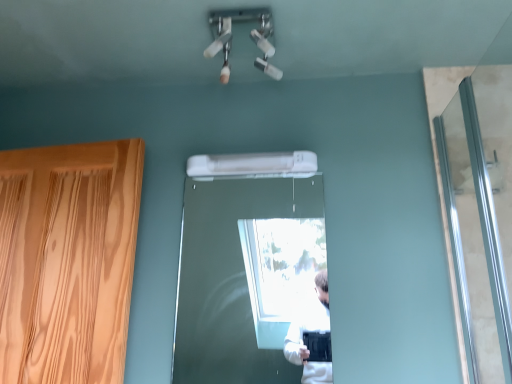
Question: Is white plastic air conditioner at center at the left side of silver metallic screen door at right?

Choices:
 (A) yes
 (B) no

Answer: (A)

Question: Is white plastic air conditioner at center further to camera compared to silver metallic screen door at right?

Choices:
 (A) yes
 (B) no

Answer: (A)

Question: Is white plastic air conditioner at center positioned beyond the bounds of silver metallic screen door at right?

Choices:
 (A) yes
 (B) no

Answer: (A)

Question: Does white plastic air conditioner at center have a greater height compared to silver metallic screen door at right?

Choices:
 (A) yes
 (B) no

Answer: (B)

Question: Does white plastic air conditioner at center turn towards silver metallic screen door at right?

Choices:
 (A) yes
 (B) no

Answer: (B)

Question: Considering the positions of white plastic air conditioner at center and silver metallic screen door at right in the image, is white plastic air conditioner at center bigger or smaller than silver metallic screen door at right?

Choices:
 (A) big
 (B) small

Answer: (B)

Question: Is white plastic air conditioner at center wider or thinner than silver metallic screen door at right?

Choices:
 (A) wide
 (B) thin

Answer: (A)

Question: Considering the positions of white plastic air conditioner at center and silver metallic screen door at right in the image, is white plastic air conditioner at center taller or shorter than silver metallic screen door at right?

Choices:
 (A) short
 (B) tall

Answer: (A)

Question: Choose the correct answer: Is white plastic air conditioner at center inside silver metallic screen door at right or outside it?

Choices:
 (A) outside
 (B) inside

Answer: (A)

Question: Is silver metallic screen door at right in front of or behind white plastic air conditioner at center in the image?

Choices:
 (A) behind
 (B) front

Answer: (B)

Question: Do you think silver metallic screen door at right is within white plastic air conditioner at center, or outside of it?

Choices:
 (A) outside
 (B) inside

Answer: (A)

Question: Is point (489, 155) closer or farther from the camera than point (204, 178)?

Choices:
 (A) farther
 (B) closer

Answer: (B)

Question: In the image, is silver metallic screen door at right on the left side or the right side of white plastic air conditioner at center?

Choices:
 (A) right
 (B) left

Answer: (A)

Question: Choose the correct answer: Is silver metallic screen door at right inside wooden door at center or outside it?

Choices:
 (A) inside
 (B) outside

Answer: (B)

Question: Would you say silver metallic screen door at right is to the left or to the right of wooden door at center in the picture?

Choices:
 (A) right
 (B) left

Answer: (A)